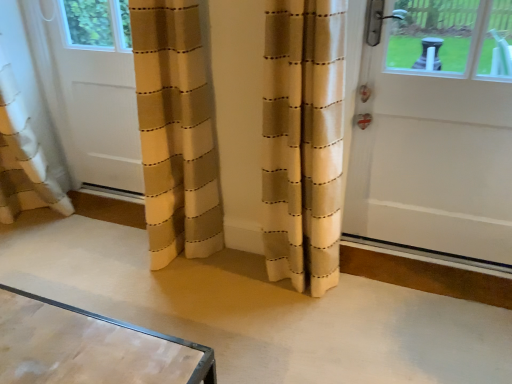
Question: In terms of width, does white glossy door at right, the second door from the left, look wider or thinner when compared to white matte door at left, marked as the 1th door in a left-to-right arrangement?

Choices:
 (A) wide
 (B) thin

Answer: (A)

Question: From a real-world perspective, relative to white matte door at left, marked as the 1th door in a left-to-right arrangement, is white glossy door at right, marked as the first door in a right-to-left arrangement, vertically above or below?

Choices:
 (A) below
 (B) above

Answer: (B)

Question: Does point 473,49 appear closer or farther from the camera than point 96,105?

Choices:
 (A) farther
 (B) closer

Answer: (B)

Question: In terms of height, does white matte door at left, marked as the 1th door in a left-to-right arrangement, look taller or shorter compared to white glossy door at right, the second door from the left?

Choices:
 (A) tall
 (B) short

Answer: (B)

Question: Considering the positions of white matte door at left, the 2th door in the right-to-left sequence, and white glossy door at right, marked as the first door in a right-to-left arrangement, in the image, is white matte door at left, the 2th door in the right-to-left sequence, wider or thinner than white glossy door at right, marked as the first door in a right-to-left arrangement,?

Choices:
 (A) wide
 (B) thin

Answer: (B)

Question: Relative to white glossy door at right, marked as the first door in a right-to-left arrangement, is white matte door at left, marked as the 1th door in a left-to-right arrangement, in front or behind?

Choices:
 (A) front
 (B) behind

Answer: (B)

Question: Based on their positions, is white matte door at left, the 2th door in the right-to-left sequence, located to the left or right of white glossy door at right, the second door from the left?

Choices:
 (A) left
 (B) right

Answer: (A)